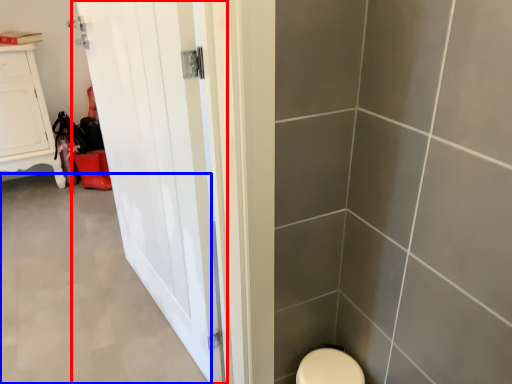
Question: Which object is further to the camera taking this photo, door (highlighted by a red box) or plain (highlighted by a blue box)?

Choices:
 (A) door
 (B) plain

Answer: (B)